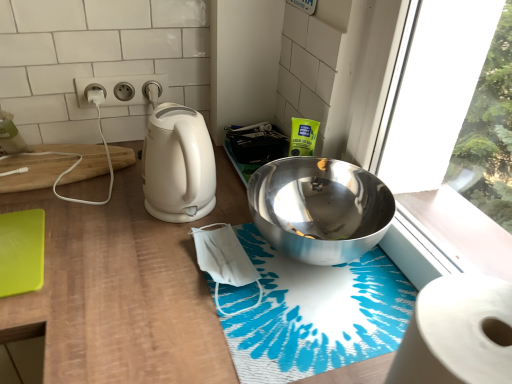
What are the coordinates of `free space to the left of silver metallic bowl at upper right` in the screenshot? It's located at (175, 252).